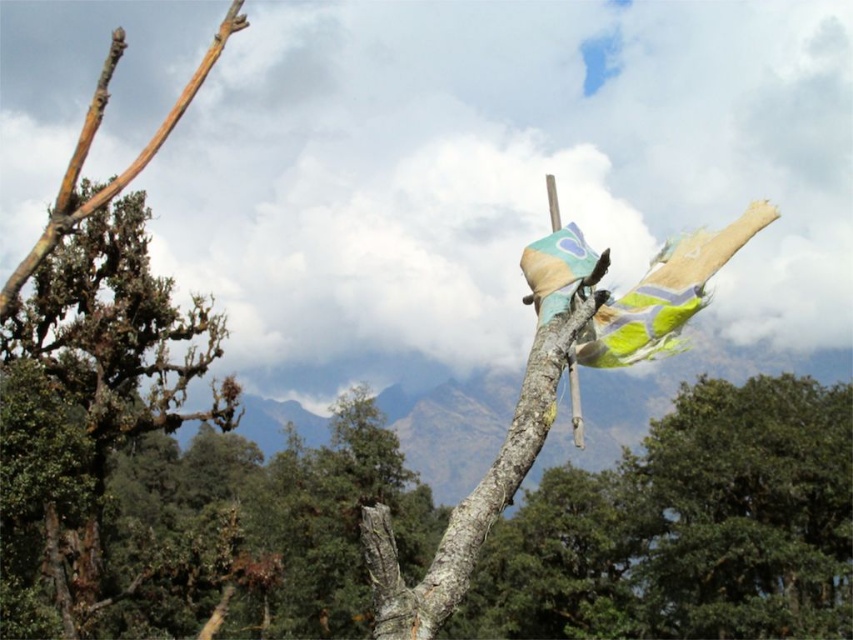
Measure the distance between green leafy tree at lower right and camera.

green leafy tree at lower right is 53.44 meters away from camera.

Which of these two, green leafy tree at lower right or brown rough bark at left, stands taller?

Standing taller between the two is green leafy tree at lower right.

In order to click on green leafy tree at lower right in this screenshot , I will do `click(744, 512)`.